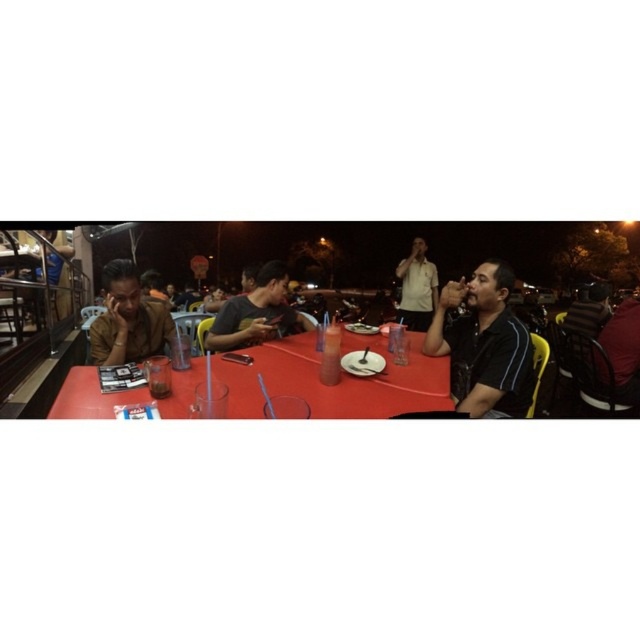
Does matte brown shirt at left have a greater width compared to smooth plastic fork at center?

Yes, matte brown shirt at left is wider than smooth plastic fork at center.

Is matte brown shirt at left smaller than smooth plastic fork at center?

No.

Between point (148, 355) and point (372, 330), which one is positioned behind?

The point (372, 330) is more distant.

Find the location of `matte brown shirt at left`. matte brown shirt at left is located at coordinates (128, 320).

Is dark gray fabric shirt at center bigger than smooth plastic fork at center?

Yes.

How much distance is there between dark gray fabric shirt at center and smooth plastic fork at center?

17.79 inches

Does point (268, 262) come closer to viewer compared to point (356, 326)?

That is True.

Locate an element on the screen. This screenshot has height=640, width=640. dark gray fabric shirt at center is located at coordinates (257, 314).

Is dark red leather jacket at lower right bigger than smooth plastic fork at center?

Yes, dark red leather jacket at lower right is bigger than smooth plastic fork at center.

Is dark red leather jacket at lower right thinner than smooth plastic fork at center?

No.

Is point (625, 353) more distant than point (349, 323)?

No, (625, 353) is closer to viewer.

This screenshot has height=640, width=640. In order to click on dark red leather jacket at lower right in this screenshot , I will do `click(624, 349)`.